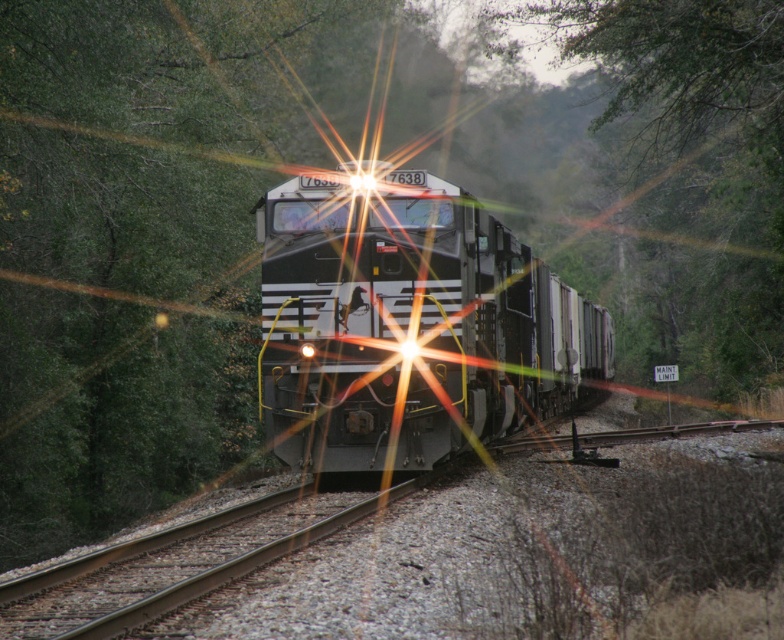
Question: Does metallic freight train at center have a smaller size compared to green leafy tree at center?

Choices:
 (A) yes
 (B) no

Answer: (A)

Question: Which object is farther from the camera taking this photo?

Choices:
 (A) metallic freight train at center
 (B) green leafy tree at center

Answer: (B)

Question: Is the position of metallic freight train at center less distant than that of green leafy tree at center?

Choices:
 (A) yes
 (B) no

Answer: (A)

Question: Which object appears closest to the camera in this image?

Choices:
 (A) green leafy tree at center
 (B) metallic freight train at center

Answer: (B)

Question: Can you confirm if metallic freight train at center is thinner than green leafy tree at center?

Choices:
 (A) yes
 (B) no

Answer: (B)